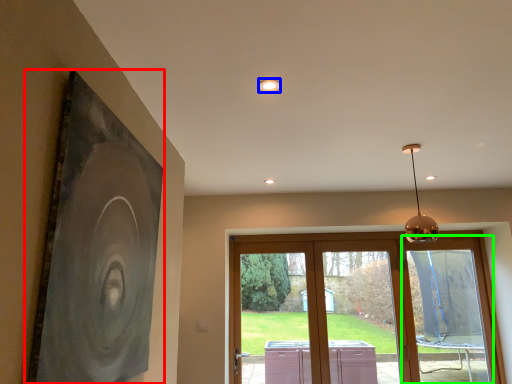
Question: Which object is positioned closest to picture frame (highlighted by a red box)? Select from lighting (highlighted by a blue box) and window (highlighted by a green box).

Choices:
 (A) lighting
 (B) window

Answer: (A)